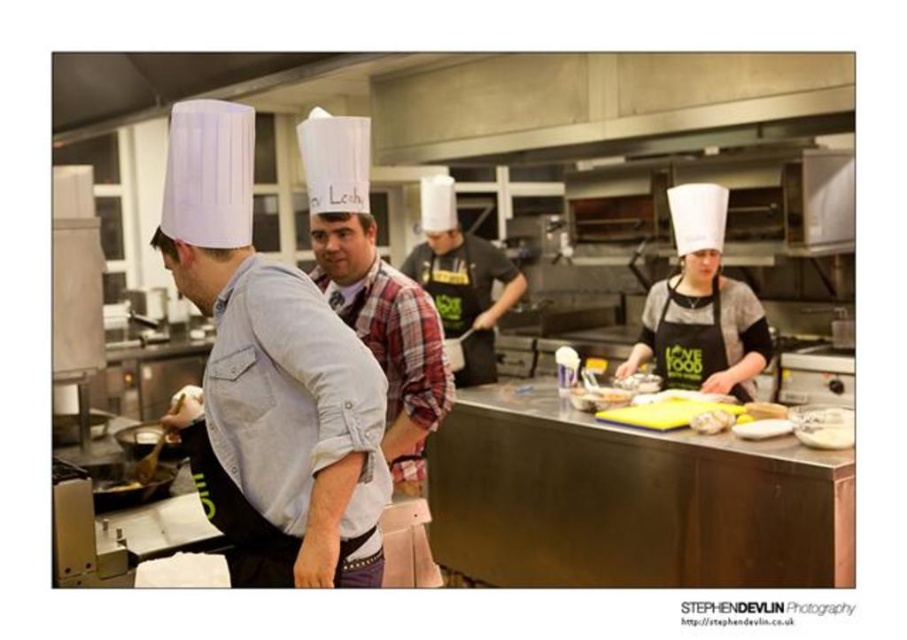
Is black matte chef hat at center to the left of white creamy cheese at center from the viewer's perspective?

Yes, black matte chef hat at center is to the left of white creamy cheese at center.

From the picture: Between black matte chef hat at center and white creamy cheese at center, which one appears on the left side from the viewer's perspective?

Positioned to the left is black matte chef hat at center.

Between point (408, 273) and point (691, 426), which one is positioned in front?

Point (691, 426) is more forward.

This screenshot has width=907, height=640. I want to click on black matte chef hat at center, so coord(461,280).

Does black matte chef hat at center have a smaller size compared to yellow rubber gloves at center?

No, black matte chef hat at center is not smaller than yellow rubber gloves at center.

Can you confirm if black matte chef hat at center is shorter than yellow rubber gloves at center?

Incorrect, black matte chef hat at center's height does not fall short of yellow rubber gloves at center's.

Who is more forward, (473, 332) or (763, 416)?

Positioned in front is point (763, 416).

The height and width of the screenshot is (640, 907). Find the location of `black matte chef hat at center`. black matte chef hat at center is located at coordinates (461, 280).

Is the position of white creamy cheese at center more distant than that of yellow rubber gloves at center?

No, it is not.

In order to click on white creamy cheese at center in this screenshot , I will do `click(712, 420)`.